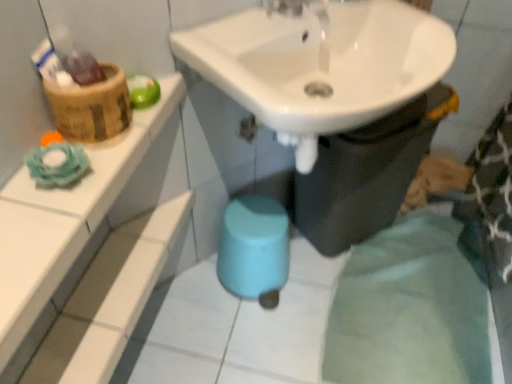
Question: Can you confirm if white glossy tile at upper left is shorter than wooden basket at upper left?

Choices:
 (A) yes
 (B) no

Answer: (A)

Question: Considering the relative sizes of white glossy tile at upper left and wooden basket at upper left in the image provided, is white glossy tile at upper left wider than wooden basket at upper left?

Choices:
 (A) yes
 (B) no

Answer: (A)

Question: Would you consider white glossy tile at upper left to be distant from wooden basket at upper left?

Choices:
 (A) yes
 (B) no

Answer: (B)

Question: From a real-world perspective, does white glossy tile at upper left stand above wooden basket at upper left?

Choices:
 (A) yes
 (B) no

Answer: (B)

Question: From a real-world perspective, is white glossy tile at upper left beneath wooden basket at upper left?

Choices:
 (A) yes
 (B) no

Answer: (A)

Question: Would you say white glossy sink at center is inside or outside white glossy tile at upper left?

Choices:
 (A) outside
 (B) inside

Answer: (A)

Question: From the image's perspective, relative to white glossy tile at upper left, is white glossy sink at center above or below?

Choices:
 (A) below
 (B) above

Answer: (B)

Question: In terms of height, does white glossy sink at center look taller or shorter compared to white glossy tile at upper left?

Choices:
 (A) tall
 (B) short

Answer: (A)

Question: Is point (338, 246) positioned closer to the camera than point (94, 306)?

Choices:
 (A) closer
 (B) farther

Answer: (B)

Question: Is white glossy sink at center spatially inside white glossy sink at upper center, or outside of it?

Choices:
 (A) outside
 (B) inside

Answer: (A)

Question: Considering the positions of point (424, 150) and point (322, 67), is point (424, 150) closer or farther from the camera than point (322, 67)?

Choices:
 (A) farther
 (B) closer

Answer: (A)

Question: From a real-world perspective, is white glossy sink at center physically located above or below white glossy sink at upper center?

Choices:
 (A) above
 (B) below

Answer: (B)

Question: In terms of height, does white glossy sink at center look taller or shorter compared to white glossy sink at upper center?

Choices:
 (A) tall
 (B) short

Answer: (A)

Question: From a real-world perspective, is white glossy sink at upper center above or below white glossy sink at center?

Choices:
 (A) above
 (B) below

Answer: (A)

Question: Which is correct: white glossy sink at upper center is inside white glossy sink at center, or outside of it?

Choices:
 (A) outside
 (B) inside

Answer: (A)